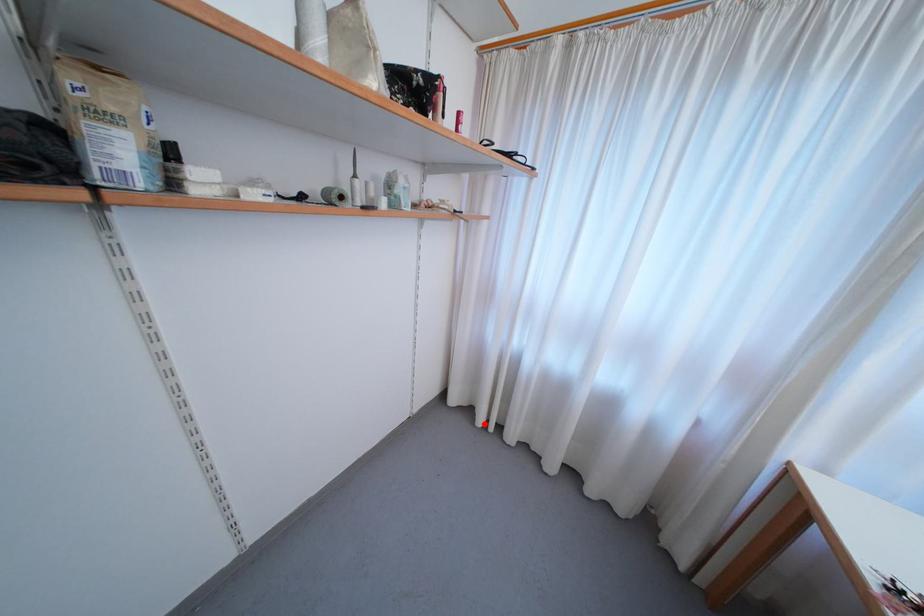
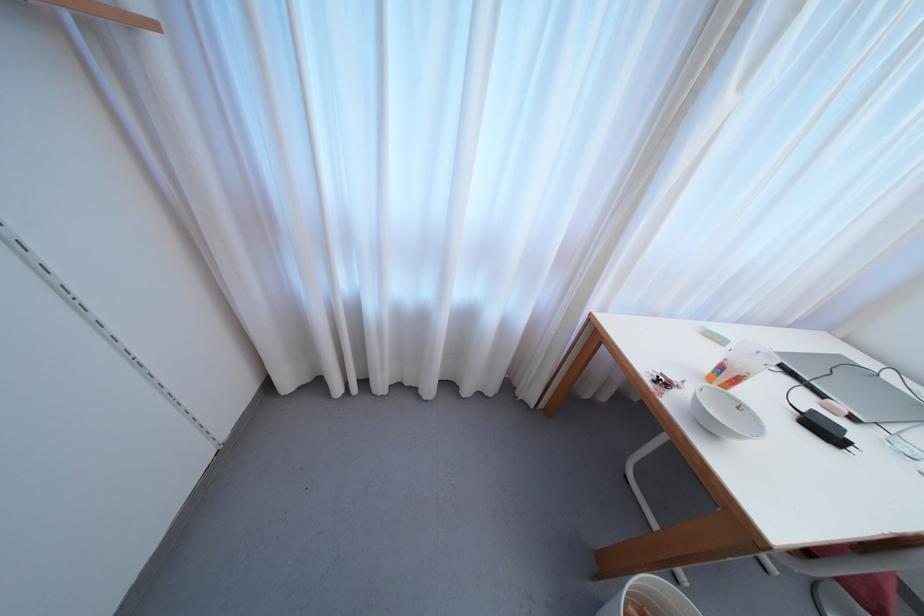
Find the pixel in the second image that matches the highlighted location in the first image.

(342, 392)